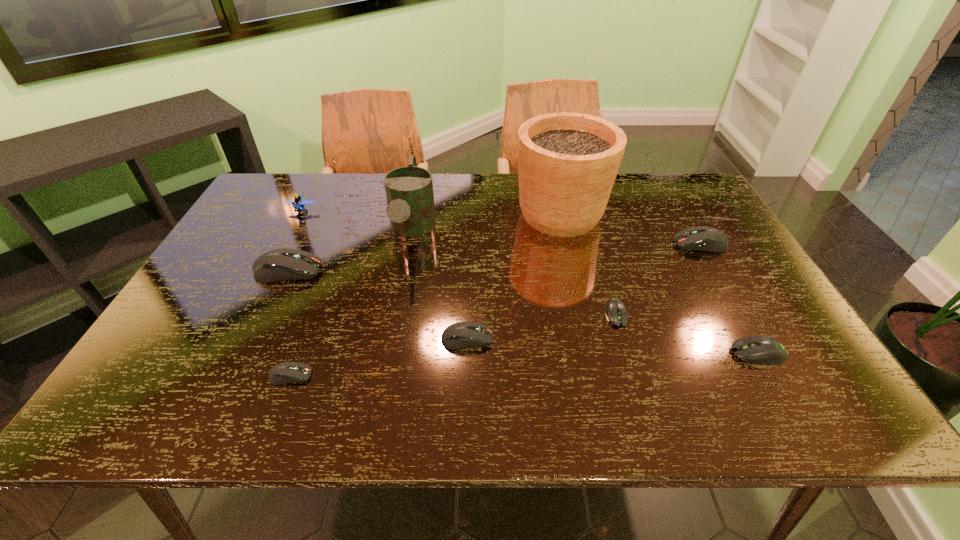
You are a GUI agent. You are given a task and a screenshot of the screen. Output one action in this format:
    pyautogui.click(x=<x>, y=<y>)
    Task: Click on the right gray computer mouse
    Image resolution: width=960 pixels, height=540 pixels.
    Given the screenshot: What is the action you would take?
    pyautogui.click(x=765, y=350)

This screenshot has width=960, height=540. I want to click on the bigger gray computer mouse, so click(765, 350).

I want to click on the smallest dark computer equipment, so click(286, 372).

Find the location of a particular element. The height and width of the screenshot is (540, 960). the nearest dark computer equipment is located at coordinates (286, 372).

Where is `the left gray computer mouse`? This screenshot has width=960, height=540. the left gray computer mouse is located at coordinates (616, 312).

I want to click on the fourth computer mouse from left to right, so click(616, 312).

Locate an element on the screen. The image size is (960, 540). free region located on the left of the tallest object is located at coordinates (456, 214).

The image size is (960, 540). Find the location of `vacant area situated 0.340m with the spout on the green watering can`. vacant area situated 0.340m with the spout on the green watering can is located at coordinates (385, 374).

I want to click on free space located 0.390m on the button of the tallest computer mouse, so click(x=467, y=271).

Where is `free space located on the front-facing side of the blue Lego`? free space located on the front-facing side of the blue Lego is located at coordinates (281, 250).